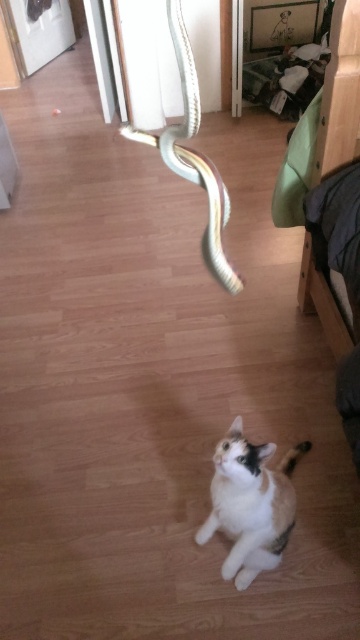
Does shiny metallic snake at upper center appear over white glossy tail at lower center?

Indeed, shiny metallic snake at upper center is positioned over white glossy tail at lower center.

Is shiny metallic snake at upper center positioned before white glossy tail at lower center?

Yes, shiny metallic snake at upper center is in front of white glossy tail at lower center.

Who is more distant from viewer, (168,8) or (285,470)?

The point (285,470) is more distant.

Identify the location of shiny metallic snake at upper center. (192, 154).

Who is shorter, calico fur cat at center or white glossy tail at lower center?

Standing shorter between the two is white glossy tail at lower center.

Is calico fur cat at center closer to the viewer compared to white glossy tail at lower center?

Yes, calico fur cat at center is in front of white glossy tail at lower center.

Does point (216, 508) come farther from viewer compared to point (307, 449)?

No, (216, 508) is closer to viewer.

Image resolution: width=360 pixels, height=640 pixels. Identify the location of calico fur cat at center. (249, 502).

Is calico fur cat at center shorter than shiny metallic snake at upper center?

Yes.

Who is lower down, calico fur cat at center or shiny metallic snake at upper center?

calico fur cat at center is lower down.

Where is `calico fur cat at center`? This screenshot has height=640, width=360. calico fur cat at center is located at coordinates (249, 502).